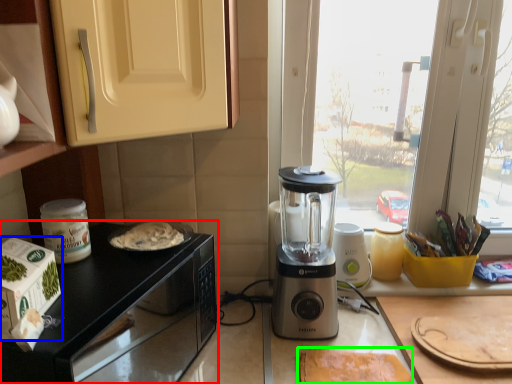
Question: Which object is the farthest from countertop (highlighted by a red box)? Choose among these: home appliance (highlighted by a blue box) or food (highlighted by a green box).

Choices:
 (A) home appliance
 (B) food

Answer: (B)